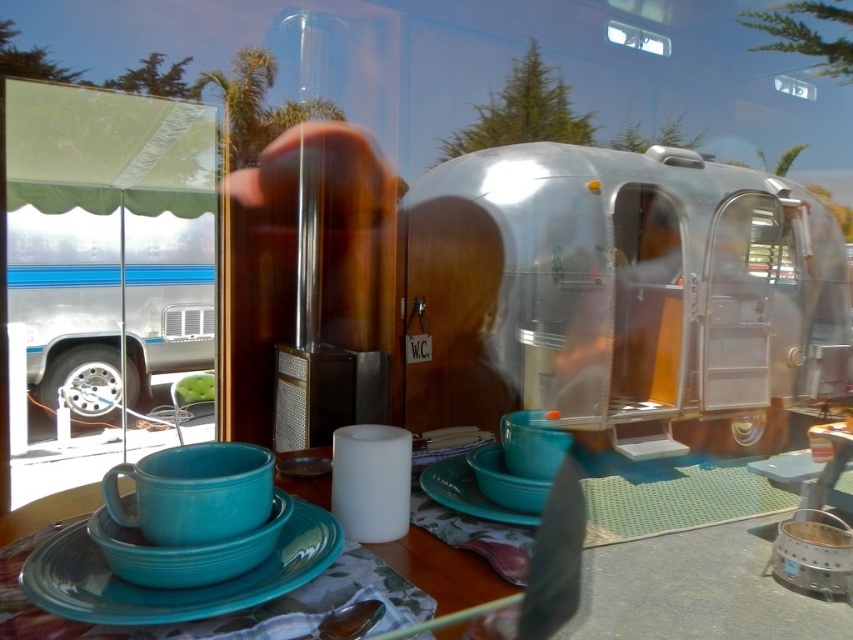
You are planning to place a new decorative item on the table. The item is 10 cm tall. Considering the shiny silver trailer at center and the teal ceramic tableware at center, which object is taller and will the new item fit under it?

The shiny silver trailer at center is taller than the teal ceramic tableware at center. Since the new item is 10 cm tall, it will fit under both objects as their heights are greater than 10 cm.

You are setting up a table for a picnic and have a teal matte saucer at center and a matte blue plate at center. Which item should you choose if you need a wider surface to place a sandwich?

The teal matte saucer at center might be wider than matte blue plate at center, so it could provide a wider surface for the sandwich.

You are setting up a picnic table in the trailer and need to place a teal matte saucer at center. You want to ensure there is enough space between it and the shiny silver trailer at center. How much vertical space is between them?

The shiny silver trailer at center is located above the teal matte saucer at center, so there is no vertical space between them since one is directly above the other.